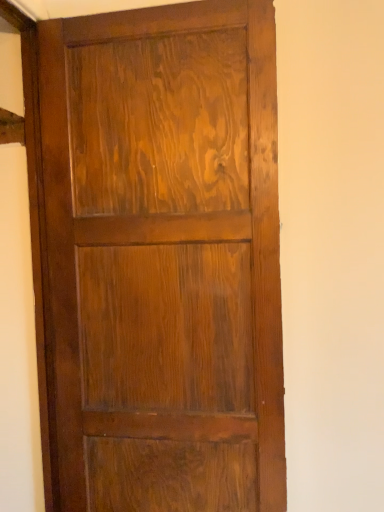
Question: Should I look upward or downward to see shiny brown wood door at center?

Choices:
 (A) up
 (B) down

Answer: (B)